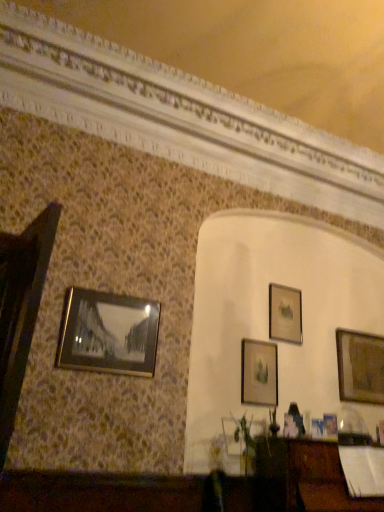
Question: Considering the relative sizes of matte gold picture frame at upper right, which is the 4th picture frame from front to back, and metallic gold picture frame at lower right, acting as the fourth picture frame starting from the left, in the image provided, is matte gold picture frame at upper right, which is the 4th picture frame from front to back, smaller than metallic gold picture frame at lower right, acting as the fourth picture frame starting from the left,?

Choices:
 (A) yes
 (B) no

Answer: (B)

Question: Is matte gold picture frame at upper right, the third picture frame in the right-to-left sequence, looking in the opposite direction of metallic gold picture frame at lower right, which is the second picture frame from right to left?

Choices:
 (A) no
 (B) yes

Answer: (A)

Question: Can you confirm if matte gold picture frame at upper right, which is the 2th picture frame in back-to-front order, is bigger than metallic gold picture frame at lower right, the fourth picture frame when ordered from back to front?

Choices:
 (A) yes
 (B) no

Answer: (A)

Question: Can you confirm if matte gold picture frame at upper right, which is the 4th picture frame from front to back, is positioned to the right of metallic gold picture frame at lower right, which is the 2th picture frame from front to back?

Choices:
 (A) yes
 (B) no

Answer: (B)

Question: Is matte gold picture frame at upper right, which is the 2th picture frame in back-to-front order, not near metallic gold picture frame at lower right, the fourth picture frame when ordered from back to front?

Choices:
 (A) no
 (B) yes

Answer: (A)

Question: Based on their sizes in the image, would you say matte gold picture frame at upper right, which ranks as the third picture frame in left-to-right order, is bigger or smaller than metallic gold picture frame at lower right, acting as the fourth picture frame starting from the left?

Choices:
 (A) small
 (B) big

Answer: (B)

Question: Looking at their shapes, would you say matte gold picture frame at upper right, which is the 2th picture frame in back-to-front order, is wider or thinner than metallic gold picture frame at lower right, acting as the fourth picture frame starting from the left?

Choices:
 (A) wide
 (B) thin

Answer: (B)

Question: Considering the relative positions of matte gold picture frame at upper right, which is the 2th picture frame in back-to-front order, and metallic gold picture frame at lower right, acting as the fourth picture frame starting from the left, in the image provided, is matte gold picture frame at upper right, which is the 2th picture frame in back-to-front order, to the left or to the right of metallic gold picture frame at lower right, acting as the fourth picture frame starting from the left,?

Choices:
 (A) right
 (B) left

Answer: (B)

Question: Is matte gold picture frame at upper right, which is the 2th picture frame in back-to-front order, taller or shorter than metallic gold picture frame at lower right, which is the 2th picture frame from front to back?

Choices:
 (A) tall
 (B) short

Answer: (A)

Question: Is metallic gold picture frame at lower right, which is the 2th picture frame from front to back, situated inside wooden picture frame at right, marked as the fifth picture frame in a left-to-right arrangement, or outside?

Choices:
 (A) inside
 (B) outside

Answer: (B)

Question: From the image's perspective, is metallic gold picture frame at lower right, which is the 2th picture frame from front to back, located above or below wooden picture frame at right, marked as the fifth picture frame in a left-to-right arrangement?

Choices:
 (A) above
 (B) below

Answer: (B)

Question: In terms of size, does metallic gold picture frame at lower right, the fourth picture frame when ordered from back to front, appear bigger or smaller than wooden picture frame at right, the first picture frame positioned from the right?

Choices:
 (A) small
 (B) big

Answer: (A)

Question: In the image, is metallic gold picture frame at lower right, which is the 2th picture frame from front to back, positioned in front of or behind wooden picture frame at right, the first picture frame positioned from the right?

Choices:
 (A) front
 (B) behind

Answer: (A)

Question: Does point (369, 376) appear closer or farther from the camera than point (288, 306)?

Choices:
 (A) closer
 (B) farther

Answer: (B)

Question: Is wooden picture frame at right, marked as the fifth picture frame in a left-to-right arrangement, in front of or behind matte gold picture frame at upper right, which is the 4th picture frame from front to back, in the image?

Choices:
 (A) front
 (B) behind

Answer: (B)